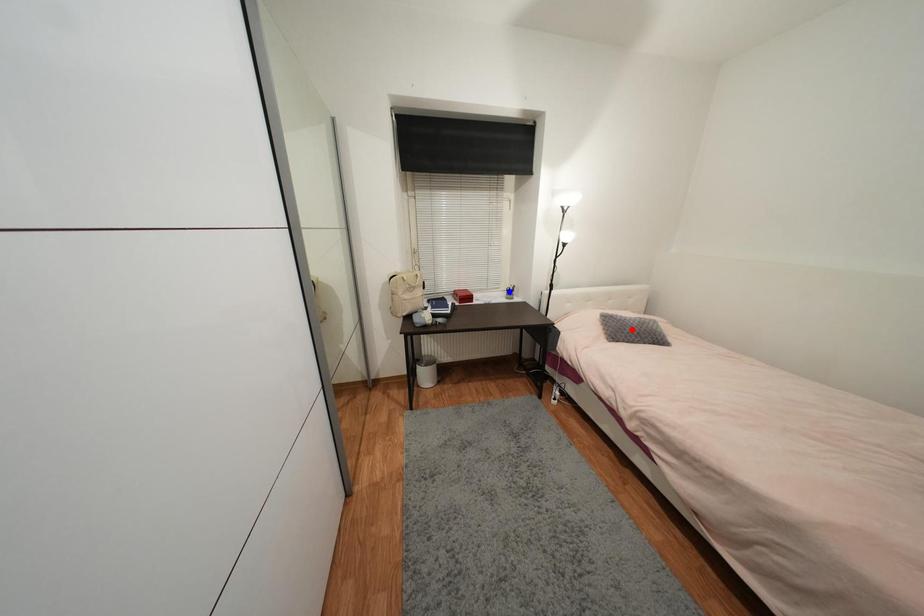
Question: Which of the two points in the image is closer to the camera?

Choices:
 (A) Blue point is closer.
 (B) Red point is closer.

Answer: (B)